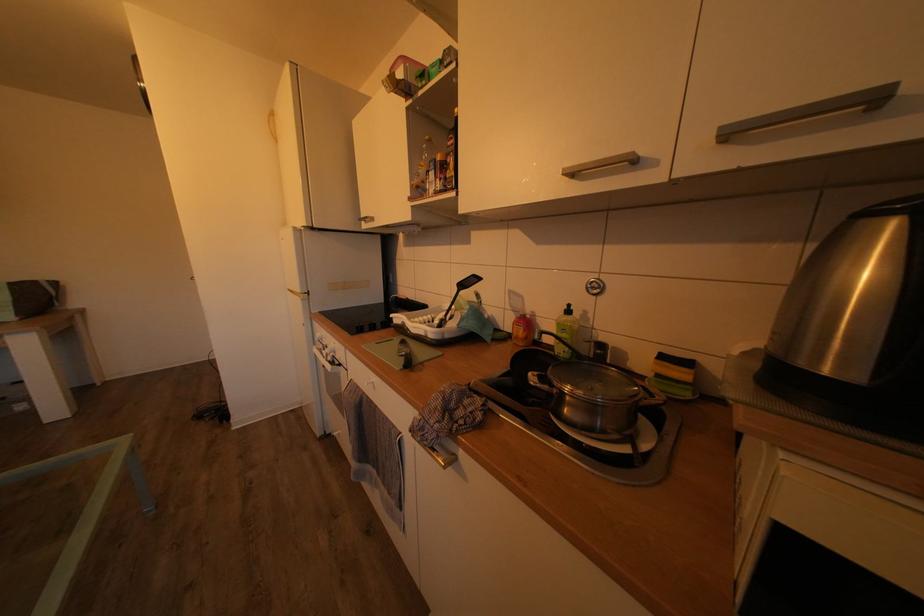
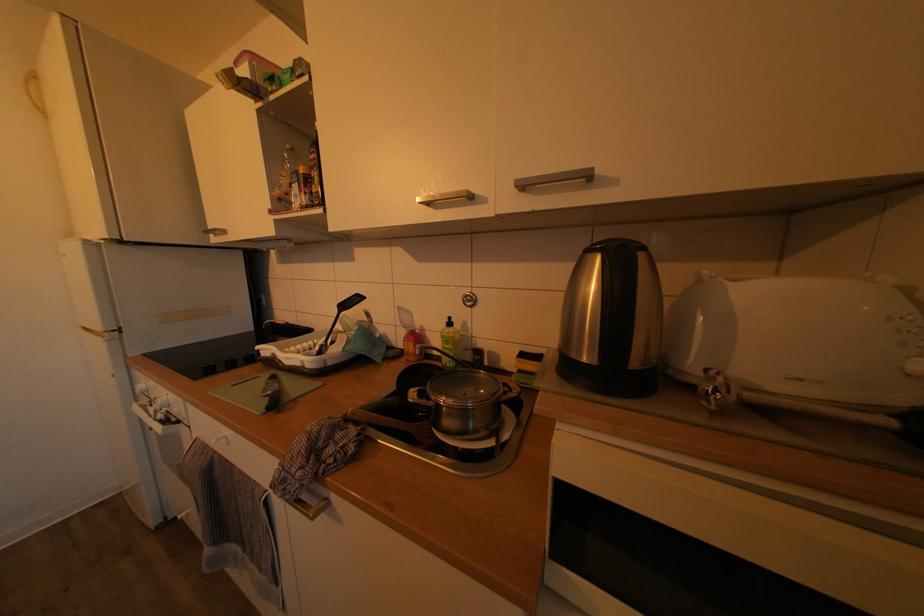
Question: In a continuous first-person perspective shot, in which direction is the camera moving?

Choices:
 (A) Left
 (B) Right
 (C) Forward
 (D) Backward

Answer: (B)